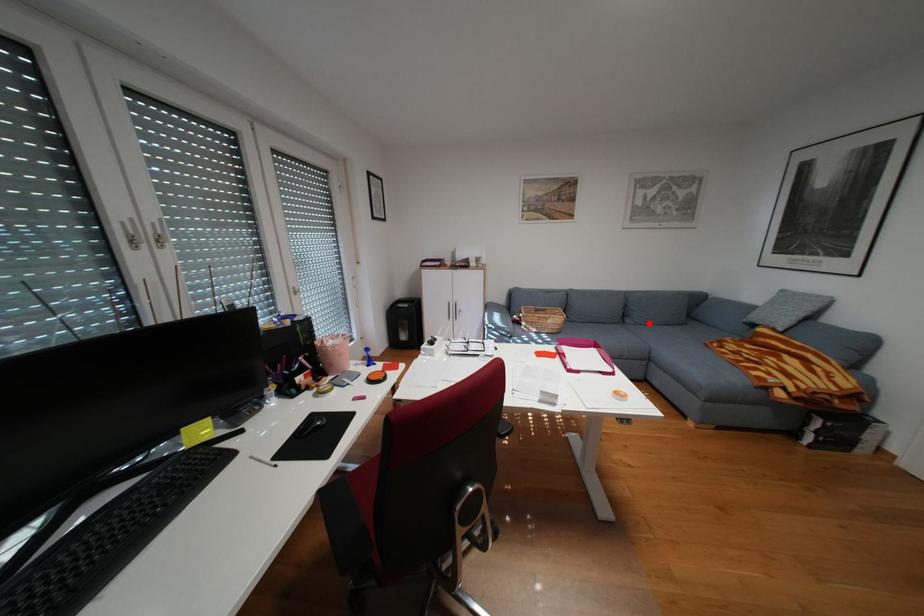
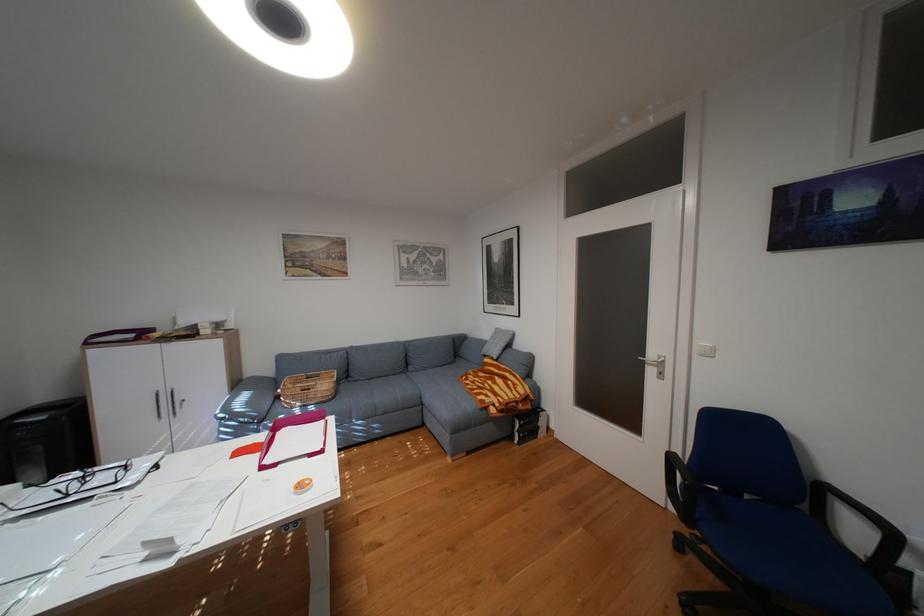
Find the pixel in the second image that matches the highlighted location in the first image.

(430, 370)